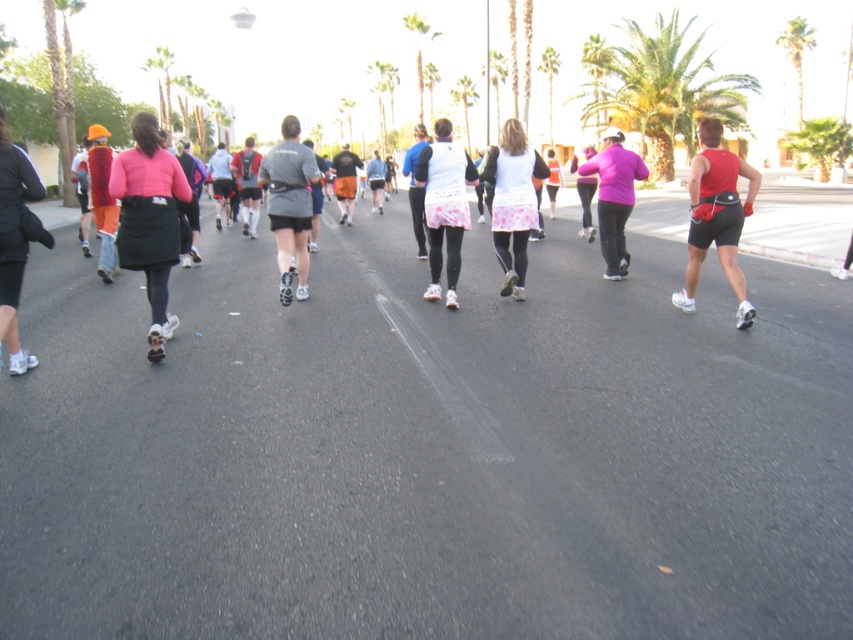
You are a photographer trying to capture a photo of the pink matte jacket at center while also including the green leafy palm tree at upper right in the frame. Based on their positions, which direction should you move to position yourself so that both objects are in your shot?

Since the green leafy palm tree at upper right is to the right of the pink matte jacket at center, you should move to the left to ensure both the pink matte jacket at center and the green leafy palm tree at upper right are within your camera frame.

You are a photographer positioned at the starting line of the marathon. You want to capture a photo that includes both the green leafy palm tree at upper right and the pink matte jacket at center. Which object will appear wider in the photo?

The green leafy palm tree at upper right will appear wider in the photo because its width is larger than the pink matte jacket at center.